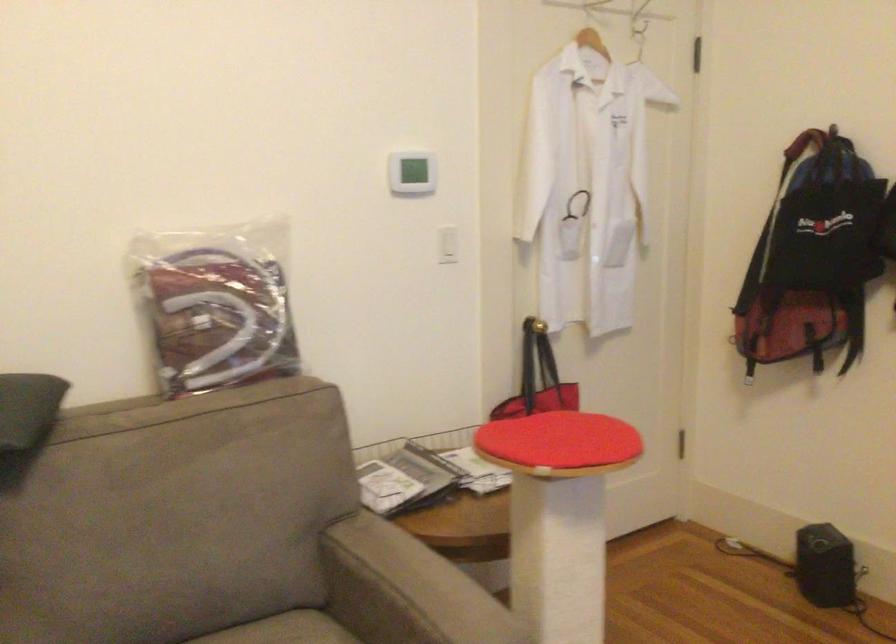
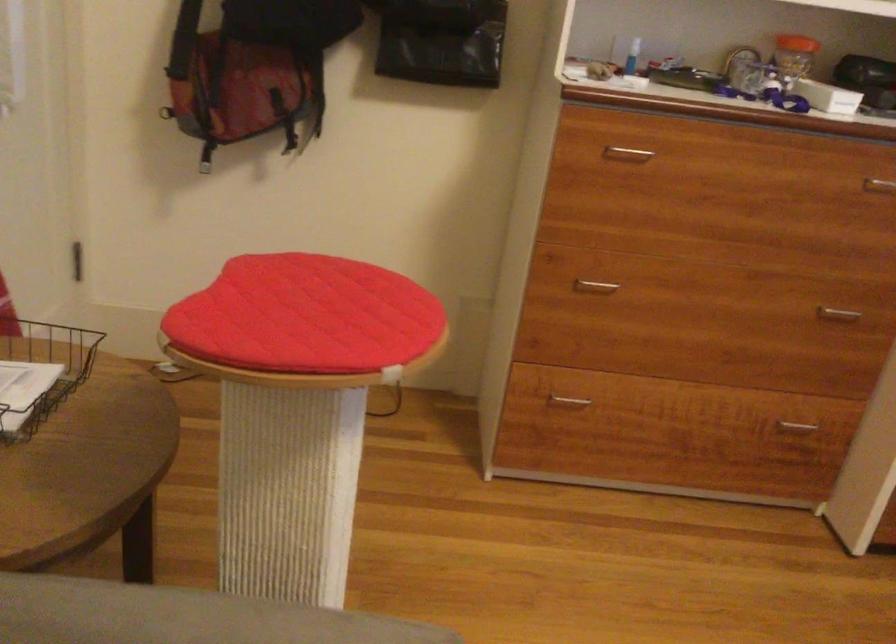
Find the pixel in the second image that matches (562,450) in the first image.

(306, 316)